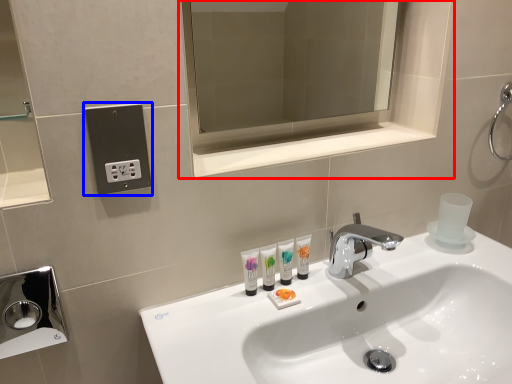
Question: Which object is further to the camera taking this photo, medicine cabinet (highlighted by a red box) or electric outlet (highlighted by a blue box)?

Choices:
 (A) medicine cabinet
 (B) electric outlet

Answer: (A)